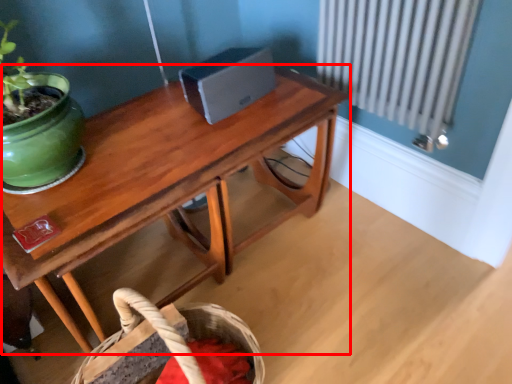
Question: From the image, what is the correct spatial relationship of table (annotated by the red box) in relation to basket?

Choices:
 (A) left
 (B) right

Answer: (B)